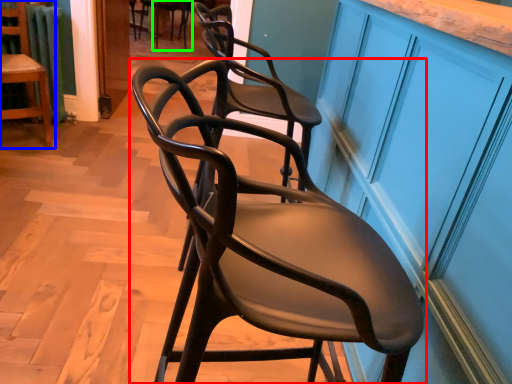
Question: Which object is the farthest from chair (highlighted by a red box)? Choose among these: chair (highlighted by a blue box) or chair (highlighted by a green box).

Choices:
 (A) chair
 (B) chair

Answer: (B)